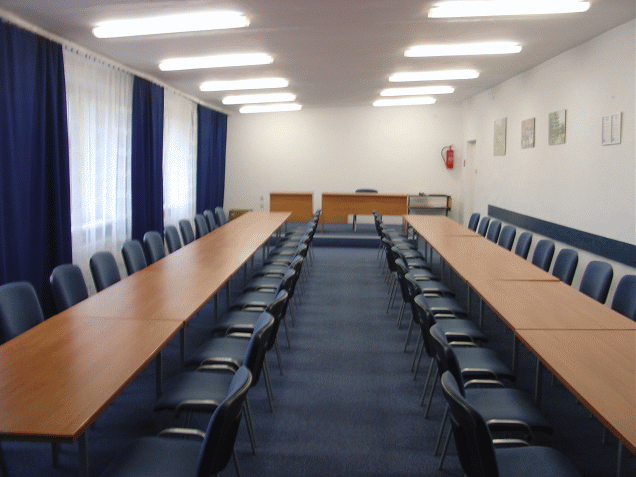
I want to click on tables on left, so click(x=76, y=395), click(x=165, y=290), click(x=224, y=248), click(x=247, y=228), click(x=268, y=212).